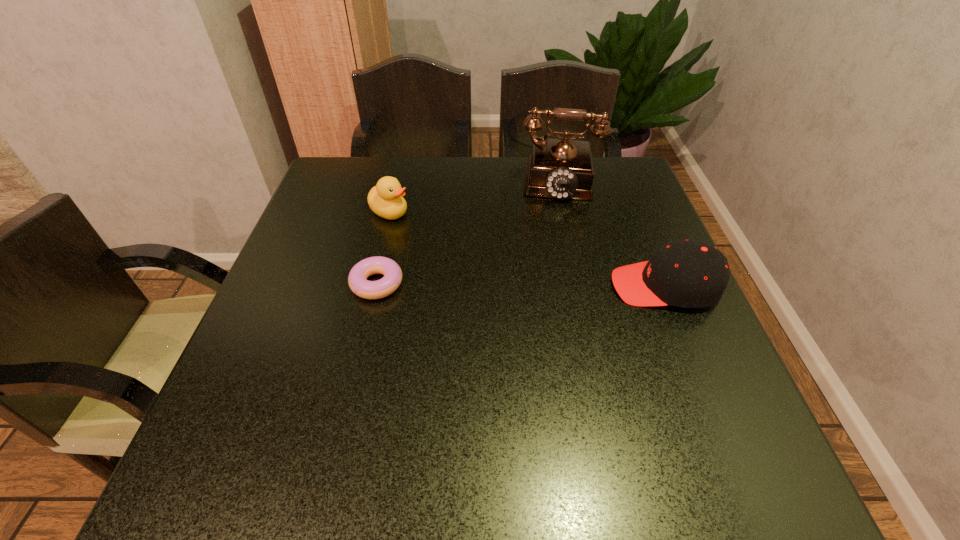
In order to click on free space at the near edge of the desktop in this screenshot , I will do `click(585, 400)`.

The height and width of the screenshot is (540, 960). Identify the location of vacant space at the left edge. (308, 343).

Where is `vacant space at the right edge`? vacant space at the right edge is located at coordinates (650, 336).

I want to click on free space at the far left corner, so click(x=356, y=190).

Locate an element on the screen. vacant space at the near left corner is located at coordinates (228, 418).

What are the coordinates of `free space that is in between the duckling and the shortest object` in the screenshot? It's located at (383, 247).

Identify the location of free space between the duckling and the cap. (527, 249).

Find the location of a particular element. vacant area that lies between the telephone and the cap is located at coordinates click(x=609, y=232).

The height and width of the screenshot is (540, 960). What are the coordinates of `vacant space in between the duckling and the shortest object` in the screenshot? It's located at (383, 247).

You are a GUI agent. You are given a task and a screenshot of the screen. Output one action in this format:
    pyautogui.click(x=<x>, y=<y>)
    Task: Click on the free space between the telephone and the cap
    This screenshot has width=960, height=540.
    Given the screenshot: What is the action you would take?
    pyautogui.click(x=609, y=232)